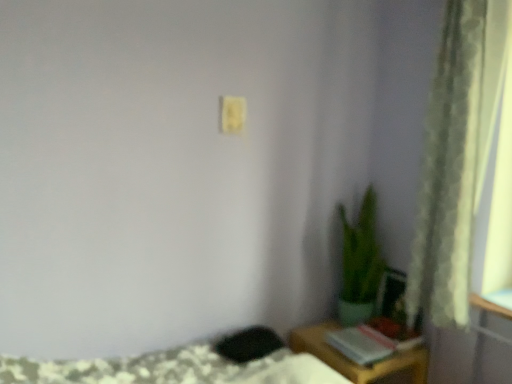
Question: From a real-world perspective, is green textured curtain at right positioned over green matte plant at lower right based on gravity?

Choices:
 (A) no
 (B) yes

Answer: (B)

Question: From a real-world perspective, is green textured curtain at right below green matte plant at lower right?

Choices:
 (A) no
 (B) yes

Answer: (A)

Question: Is green textured curtain at right shorter than green matte plant at lower right?

Choices:
 (A) yes
 (B) no

Answer: (B)

Question: Is green textured curtain at right smaller than green matte plant at lower right?

Choices:
 (A) yes
 (B) no

Answer: (A)

Question: Is green textured curtain at right with green matte plant at lower right?

Choices:
 (A) no
 (B) yes

Answer: (A)

Question: Would you say green matte plant at lower right is part of green textured curtain at right's contents?

Choices:
 (A) yes
 (B) no

Answer: (B)

Question: Is yellow matte light switch at upper center aimed at wooden table at lower right?

Choices:
 (A) no
 (B) yes

Answer: (A)

Question: From a real-world perspective, is yellow matte light switch at upper center physically above wooden table at lower right?

Choices:
 (A) no
 (B) yes

Answer: (B)

Question: Can you confirm if yellow matte light switch at upper center is positioned to the left of wooden table at lower right?

Choices:
 (A) no
 (B) yes

Answer: (B)

Question: From the image's perspective, is yellow matte light switch at upper center beneath wooden table at lower right?

Choices:
 (A) no
 (B) yes

Answer: (A)

Question: Is yellow matte light switch at upper center turned away from wooden table at lower right?

Choices:
 (A) no
 (B) yes

Answer: (A)

Question: From a real-world perspective, is yellow matte light switch at upper center under wooden table at lower right?

Choices:
 (A) no
 (B) yes

Answer: (A)

Question: From the image's perspective, is green matte plant at lower right below green textured curtain at right?

Choices:
 (A) no
 (B) yes

Answer: (B)